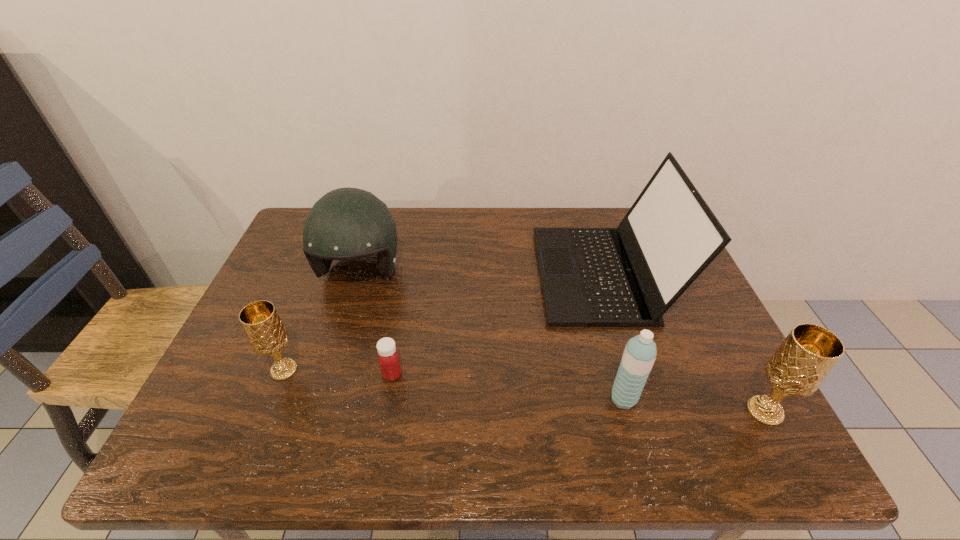
Please point a location where one more chalice can be added evenly. Please provide its 2D coordinates. Your answer should be formatted as a tuple, i.e. [(x, y)], where the tuple contains the x and y coordinates of a point satisfying the conditions above.

[(515, 390)]